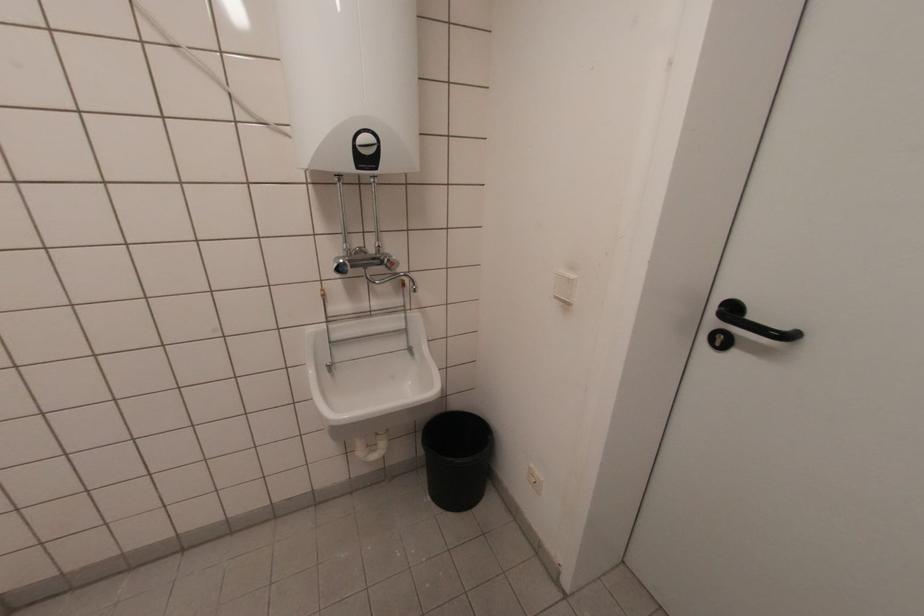
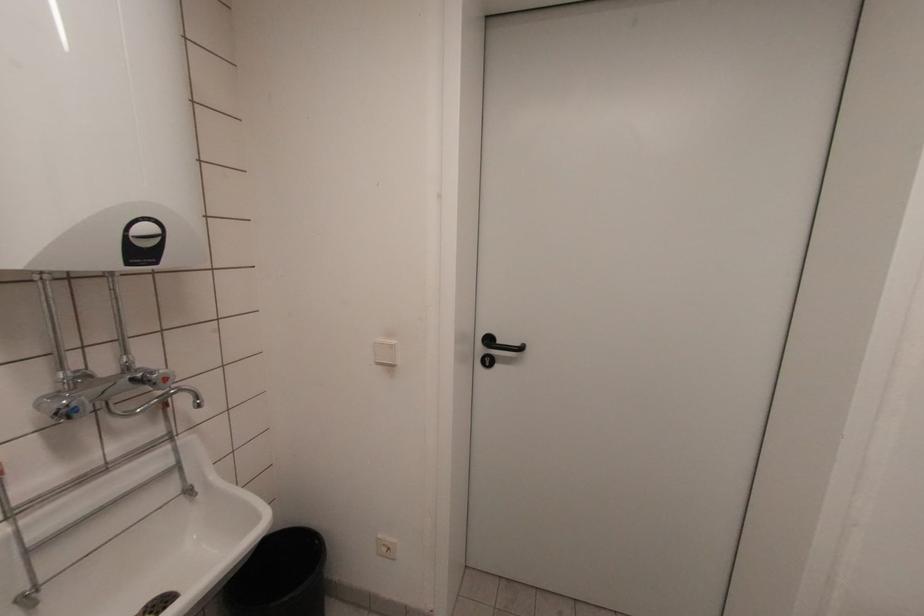
Locate, in the second image, the point that corresponds to point 394,257 in the first image.

(163, 371)